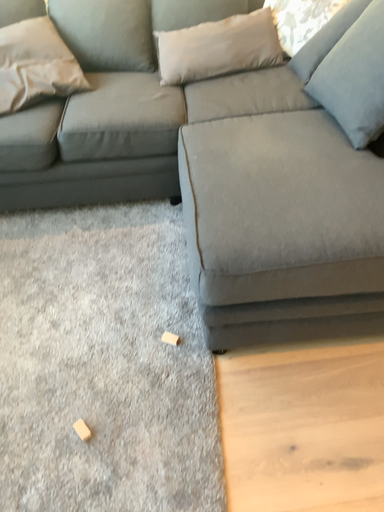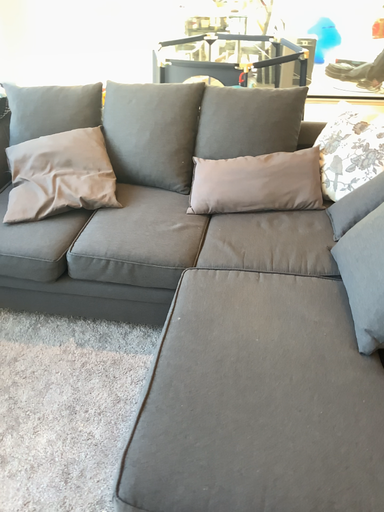
Question: Which way did the camera rotate in the video?

Choices:
 (A) rotated downward
 (B) rotated upward

Answer: (B)